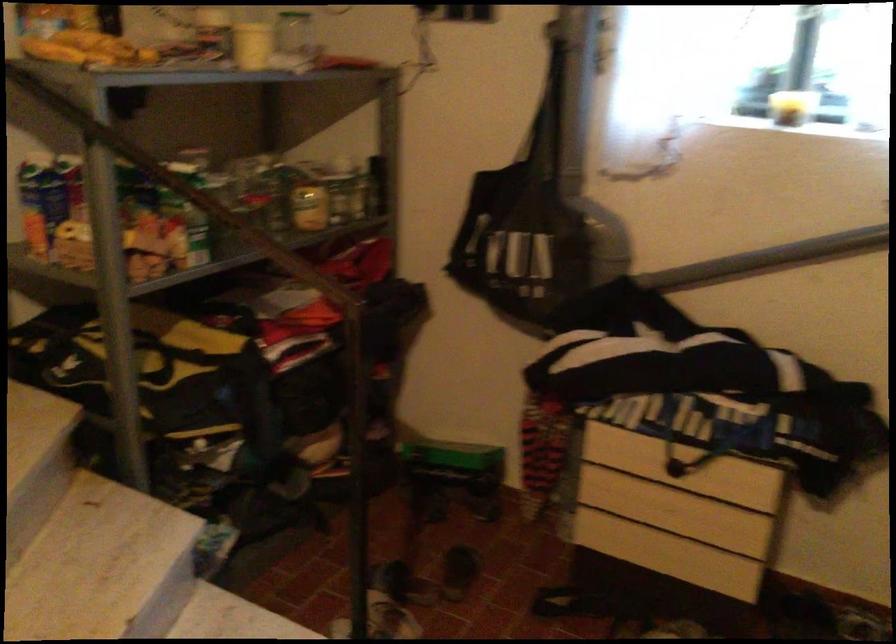
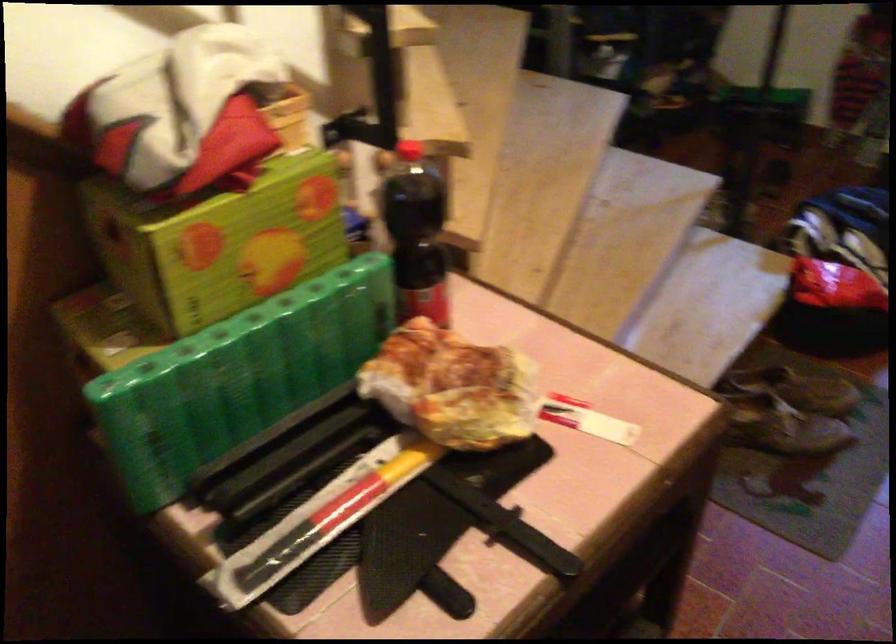
The images are taken continuously from a first-person perspective. In which direction are you moving?

The cameraman moved toward left, backward.